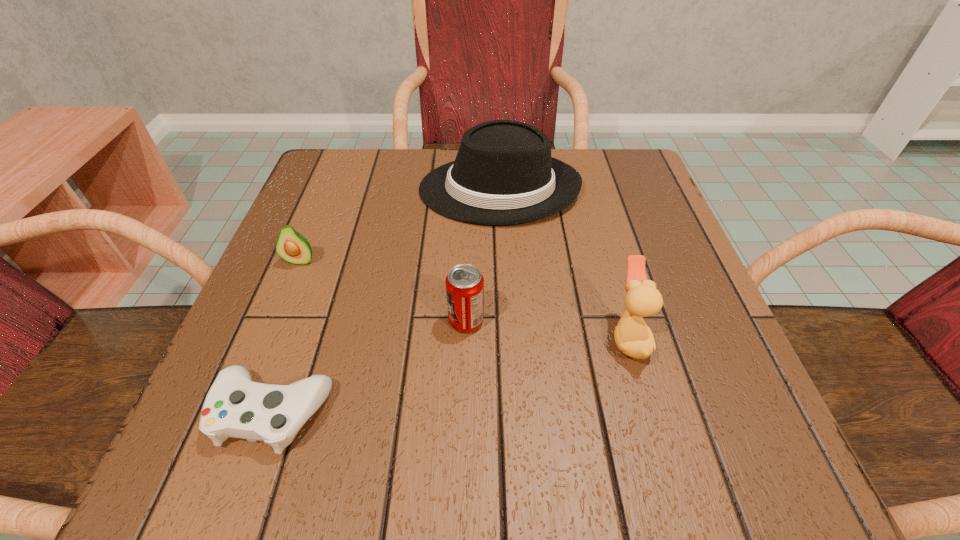
Locate an element on the screen. This screenshot has width=960, height=540. blank area located 0.390m on the beak of the duck is located at coordinates (355, 338).

At what (x,y) coordinates should I click in order to perform the action: click on vacant area located on the beak of the duck. Please return your answer as a coordinate pair (x, y). The image size is (960, 540). Looking at the image, I should click on (505, 338).

I want to click on vacant position located on the left of the soda can, so click(309, 321).

Identify the location of free location located 0.050m on the cut side of the fourth nearest object. The height and width of the screenshot is (540, 960). (289, 289).

Find the location of a particular element. vacant area situated 0.350m on the right of the control is located at coordinates (590, 413).

The height and width of the screenshot is (540, 960). What are the coordinates of `object positioned at the far edge` in the screenshot? It's located at click(503, 174).

I want to click on object situated at the near edge, so click(235, 406).

This screenshot has height=540, width=960. What are the coordinates of `avocado at the left edge` in the screenshot? It's located at (293, 247).

Where is `control that is at the left edge`? This screenshot has width=960, height=540. control that is at the left edge is located at coordinates (235, 406).

The height and width of the screenshot is (540, 960). Identify the location of fedora at the right edge. (503, 174).